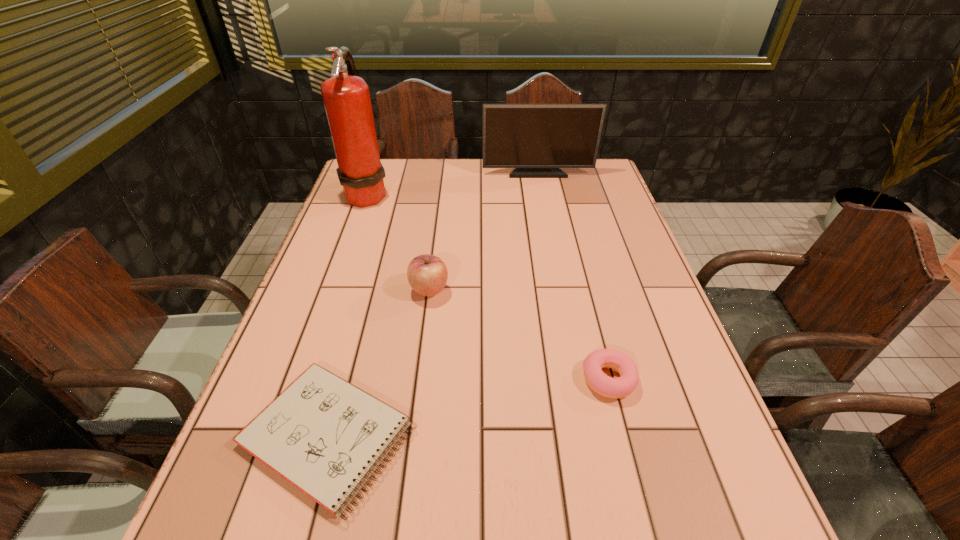
This screenshot has height=540, width=960. Find the location of `object situated at the far left corner`. object situated at the far left corner is located at coordinates (346, 97).

Where is `object that is positioned at the near left corner`? Image resolution: width=960 pixels, height=540 pixels. object that is positioned at the near left corner is located at coordinates (324, 435).

The height and width of the screenshot is (540, 960). Identify the location of object that is at the far right corner. (537, 140).

Locate an element on the screen. The width and height of the screenshot is (960, 540). free space at the far edge of the desktop is located at coordinates (443, 179).

In the image, there is a desktop. Where is `vacant space at the left edge`? vacant space at the left edge is located at coordinates (348, 218).

You are a GUI agent. You are given a task and a screenshot of the screen. Output one action in this format:
    pyautogui.click(x=<x>, y=<y>)
    Task: Click on the free space at the right edge of the desktop
    The width and height of the screenshot is (960, 540).
    Given the screenshot: What is the action you would take?
    pyautogui.click(x=668, y=346)

Where is `blank space at the far right corner of the desktop`? The width and height of the screenshot is (960, 540). blank space at the far right corner of the desktop is located at coordinates (564, 186).

Image resolution: width=960 pixels, height=540 pixels. In order to click on empty space between the shortest object and the farthest object in this screenshot , I will do `click(433, 304)`.

Image resolution: width=960 pixels, height=540 pixels. What are the coordinates of `blank region between the apple and the shortest object` in the screenshot? It's located at (379, 362).

Where is `unoccupied area between the notepad and the third nearest object`? This screenshot has height=540, width=960. unoccupied area between the notepad and the third nearest object is located at coordinates (379, 362).